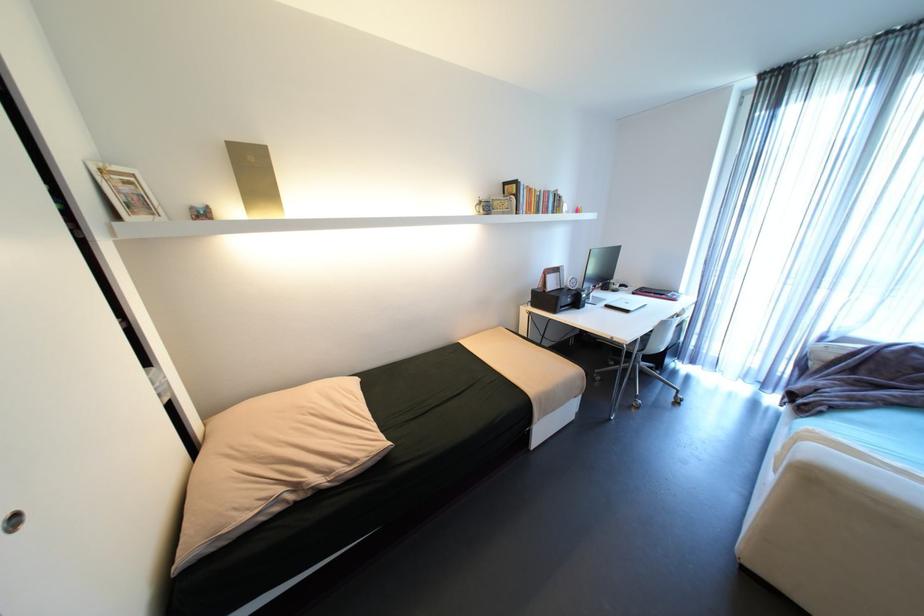
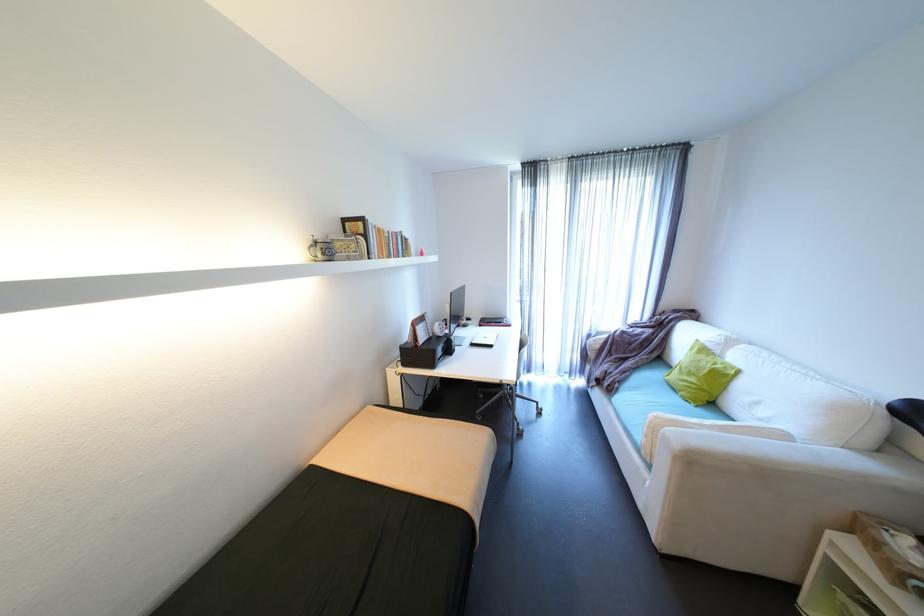
The point at (598, 251) is marked in the first image. Where is the corresponding point in the second image?

(458, 294)